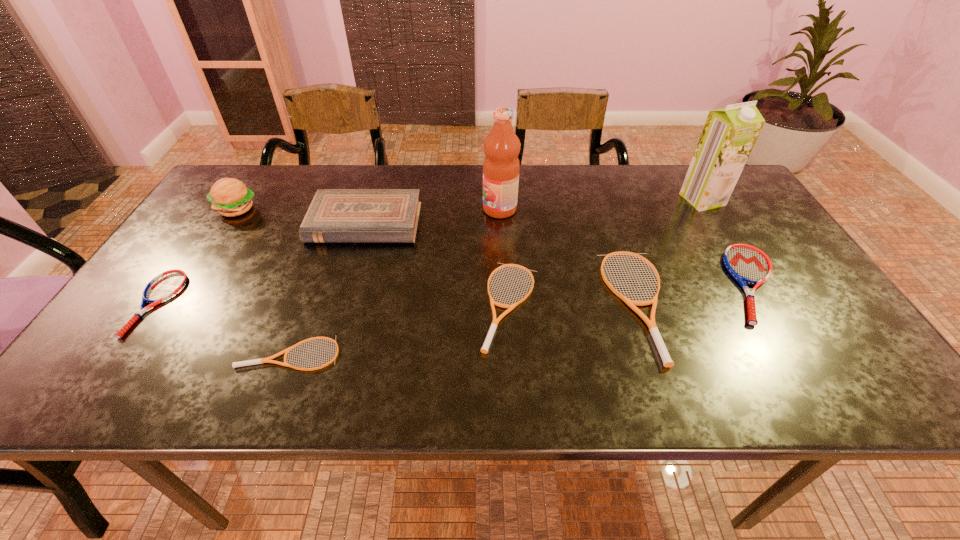
Image resolution: width=960 pixels, height=540 pixels. What are the coordinates of `unoccupied position between the green soya milk and the third tallest object` in the screenshot? It's located at (469, 205).

Find the location of a particular element. object that ranks as the seventh closest to the second tennis racket from left to right is located at coordinates (747, 264).

Locate an element on the screen. object that ranks as the seventh closest to the bigger blue tennis racket is located at coordinates (229, 196).

Find the location of a particular element. The image size is (960, 540). the closest tennis racket to the right blue tennis racket is located at coordinates (667, 361).

Point out which tennis racket is positioned as the second nearest to the smaller blue tennis racket. Please provide its 2D coordinates. Your answer should be formatted as a tuple, i.e. [(x, y)], where the tuple contains the x and y coordinates of a point satisfying the conditions above.

[(487, 342)]

Where is `beige tennis racket that can be found as the closest to the fourth tennis racket from right to left`? This screenshot has height=540, width=960. beige tennis racket that can be found as the closest to the fourth tennis racket from right to left is located at coordinates (487, 342).

Select which beige tennis racket is the third closest to the bigger blue tennis racket. Please provide its 2D coordinates. Your answer should be formatted as a tuple, i.e. [(x, y)], where the tuple contains the x and y coordinates of a point satisfying the conditions above.

[(263, 360)]

Locate an element on the screen. The width and height of the screenshot is (960, 540). vacant position in the image that satisfies the following two spatial constraints: 1. on the front side of the smallest beige tennis racket; 2. on the left side of the smaller blue tennis racket is located at coordinates (121, 353).

I want to click on vacant region that satisfies the following two spatial constraints: 1. on the front label of the fruit juice; 2. on the back side of the rightmost beige tennis racket, so click(x=505, y=305).

The width and height of the screenshot is (960, 540). In order to click on vacant space that satisfies the following two spatial constraints: 1. on the spine side of the Bible; 2. on the right side of the third object from right to left in this screenshot , I will do `click(341, 305)`.